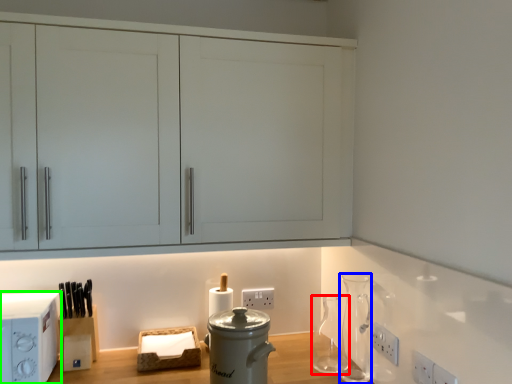
Question: Estimate the real-world distances between objects in this image. Which object is closer to glass vase (highlighted by a red box), vase (highlighted by a blue box) or home appliance (highlighted by a green box)?

Choices:
 (A) vase
 (B) home appliance

Answer: (A)